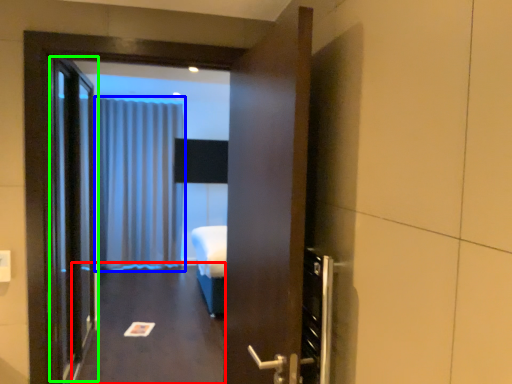
Question: Estimate the real-world distances between objects in this image. Which object is closer to corridor (highlighted by a red box), curtain (highlighted by a blue box) or elevator door (highlighted by a green box)?

Choices:
 (A) curtain
 (B) elevator door

Answer: (B)